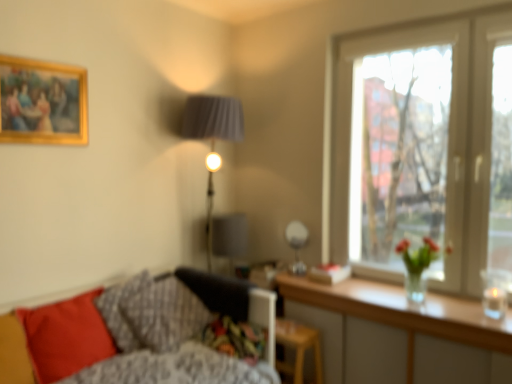
Question: From a real-world perspective, is gold-framed painting at upper left over fluffy gray pillow at lower left, arranged as the third pillow when viewed from the left?

Choices:
 (A) yes
 (B) no

Answer: (A)

Question: Does gold-framed painting at upper left have a lesser width compared to fluffy gray pillow at lower left, the first pillow positioned from the right?

Choices:
 (A) yes
 (B) no

Answer: (A)

Question: Does gold-framed painting at upper left have a smaller size compared to fluffy gray pillow at lower left, arranged as the third pillow when viewed from the left?

Choices:
 (A) no
 (B) yes

Answer: (B)

Question: Is fluffy gray pillow at lower left, the first pillow positioned from the right, surrounded by gold-framed painting at upper left?

Choices:
 (A) yes
 (B) no

Answer: (B)

Question: Does gold-framed painting at upper left appear on the left side of fluffy gray pillow at lower left, the first pillow positioned from the right?

Choices:
 (A) yes
 (B) no

Answer: (A)

Question: Is textured gray pillow at lower left, which ranks as the second pillow in right-to-left order, spatially inside matte red pillow at lower left, which is the third pillow from right to left, or outside of it?

Choices:
 (A) outside
 (B) inside

Answer: (A)

Question: From a real-world perspective, is textured gray pillow at lower left, the 2th pillow when ordered from left to right, positioned above or below matte red pillow at lower left, arranged as the first pillow when viewed from the left?

Choices:
 (A) above
 (B) below

Answer: (A)

Question: From their relative heights in the image, would you say textured gray pillow at lower left, the 2th pillow when ordered from left to right, is taller or shorter than matte red pillow at lower left, arranged as the first pillow when viewed from the left?

Choices:
 (A) short
 (B) tall

Answer: (A)

Question: Is textured gray pillow at lower left, the 2th pillow when ordered from left to right, to the left or to the right of matte red pillow at lower left, arranged as the first pillow when viewed from the left, in the image?

Choices:
 (A) right
 (B) left

Answer: (A)

Question: Considering the positions of gold-framed painting at upper left and clear wood table at lower right in the image, is gold-framed painting at upper left bigger or smaller than clear wood table at lower right?

Choices:
 (A) small
 (B) big

Answer: (A)

Question: Is gold-framed painting at upper left wider or thinner than clear wood table at lower right?

Choices:
 (A) thin
 (B) wide

Answer: (A)

Question: Is gold-framed painting at upper left to the left or to the right of clear wood table at lower right in the image?

Choices:
 (A) right
 (B) left

Answer: (B)

Question: Considering their positions, is gold-framed painting at upper left located in front of or behind clear wood table at lower right?

Choices:
 (A) behind
 (B) front

Answer: (A)

Question: Looking at the image, does wooden stool at lower center seem bigger or smaller compared to textured gray pillow at lower left, the 2th pillow when ordered from left to right?

Choices:
 (A) big
 (B) small

Answer: (B)

Question: In terms of height, does wooden stool at lower center look taller or shorter compared to textured gray pillow at lower left, the 2th pillow when ordered from left to right?

Choices:
 (A) tall
 (B) short

Answer: (B)